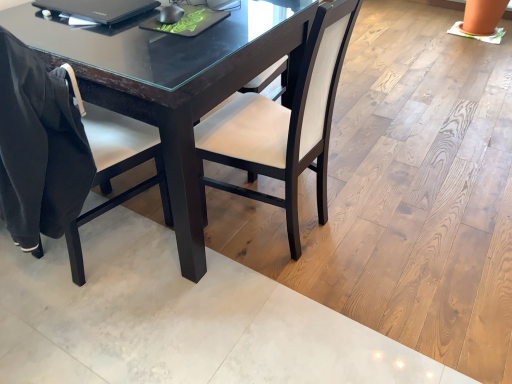
Question: Considering the positions of satin white chair at center, the 2th chair viewed from the left, and black glossy laptop at upper left in the image, is satin white chair at center, the 2th chair viewed from the left, taller or shorter than black glossy laptop at upper left?

Choices:
 (A) short
 (B) tall

Answer: (B)

Question: Based on their sizes in the image, would you say satin white chair at center, the 2th chair viewed from the left, is bigger or smaller than black glossy laptop at upper left?

Choices:
 (A) big
 (B) small

Answer: (A)

Question: Which of these objects is positioned farthest from the black glossy laptop at upper left?

Choices:
 (A) black matte chair at left, placed as the first chair when sorted from left to right
 (B) satin white chair at center, which is the first chair from right to left

Answer: (B)

Question: Considering the real-world distances, which object is closest to the black glossy laptop at upper left?

Choices:
 (A) satin white chair at center, which is the first chair from right to left
 (B) black matte chair at left, the 2th chair in the right-to-left sequence

Answer: (B)